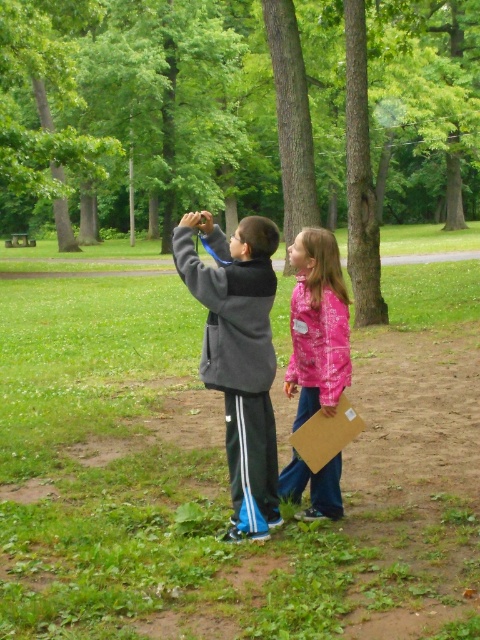
You are a photographer trying to capture a photo of both children in the park. You notice two points in the scene labeled as point (269, 256) and point (327, 449). Which point is closer to the camera so that you can focus on it to ensure both children are in sharp focus?

Point (327, 449) is closer to the camera than point (269, 256). Since the photographer wants both children in focus, focusing on the closer point might help achieve sharpness for both.

You are a photographer trying to capture a photo of the two children in the park. You notice the pink fabric jacket at lower center and the brown cardboard at lower center. Which object is taller in the frame?

The pink fabric jacket at lower center is taller than the brown cardboard at lower center.